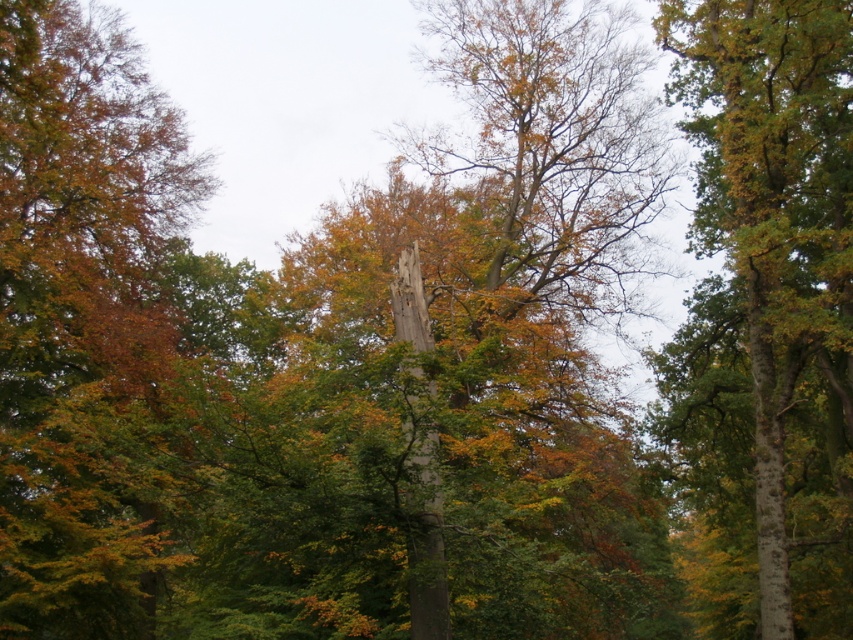
At what (x,y) coordinates should I click in order to perform the action: click on green leafy tree at left. Please return your answer as a coordinate pair (x, y). Image resolution: width=853 pixels, height=640 pixels. Looking at the image, I should click on (82, 320).

Is point (0, 291) farther from camera compared to point (433, 506)?

Yes, it is behind point (433, 506).

Is point (138, 272) farther from viewer compared to point (419, 305)?

Yes, point (138, 272) is farther from viewer.

I want to click on green leafy tree at left, so click(x=82, y=320).

Who is higher up, green smooth bark tree at center or smooth gray totem pole at center?

green smooth bark tree at center

Can you confirm if green smooth bark tree at center is positioned above smooth gray totem pole at center?

Yes.

What do you see at coordinates (775, 212) in the screenshot? Image resolution: width=853 pixels, height=640 pixels. I see `green smooth bark tree at center` at bounding box center [775, 212].

Locate an element on the screen. The height and width of the screenshot is (640, 853). green smooth bark tree at center is located at coordinates (775, 212).

Who is taller, green leafy tree at left or green smooth bark tree at center?

green smooth bark tree at center is taller.

Is green leafy tree at left thinner than green smooth bark tree at center?

Incorrect, green leafy tree at left's width is not less than green smooth bark tree at center's.

This screenshot has height=640, width=853. What do you see at coordinates (82, 320) in the screenshot?
I see `green leafy tree at left` at bounding box center [82, 320].

The width and height of the screenshot is (853, 640). What are the coordinates of `green leafy tree at left` in the screenshot? It's located at (82, 320).